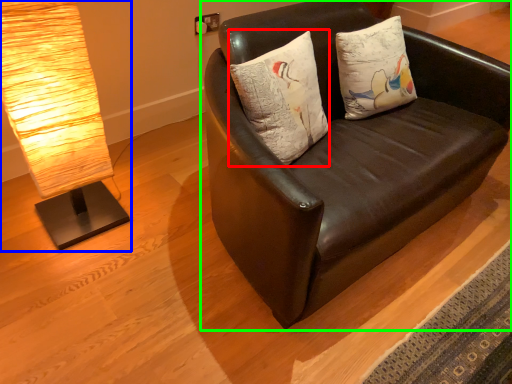
Question: Which object is positioned farthest from pillow (highlighted by a red box)? Select from lamp (highlighted by a blue box) and studio couch (highlighted by a green box).

Choices:
 (A) lamp
 (B) studio couch

Answer: (A)